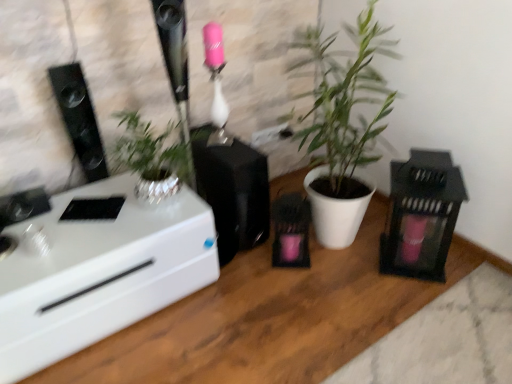
This screenshot has height=384, width=512. I want to click on free location to the right of white glossy desk at left, so click(266, 321).